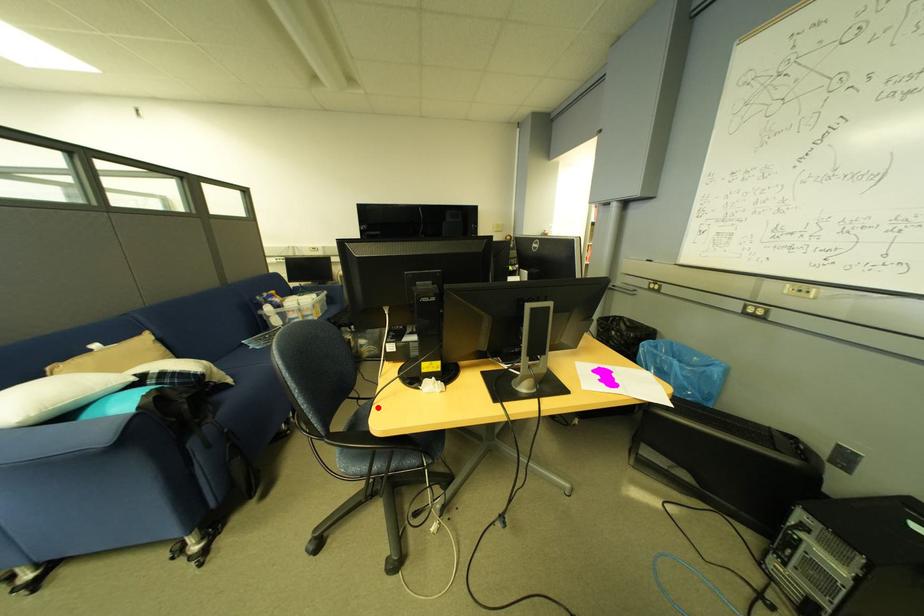
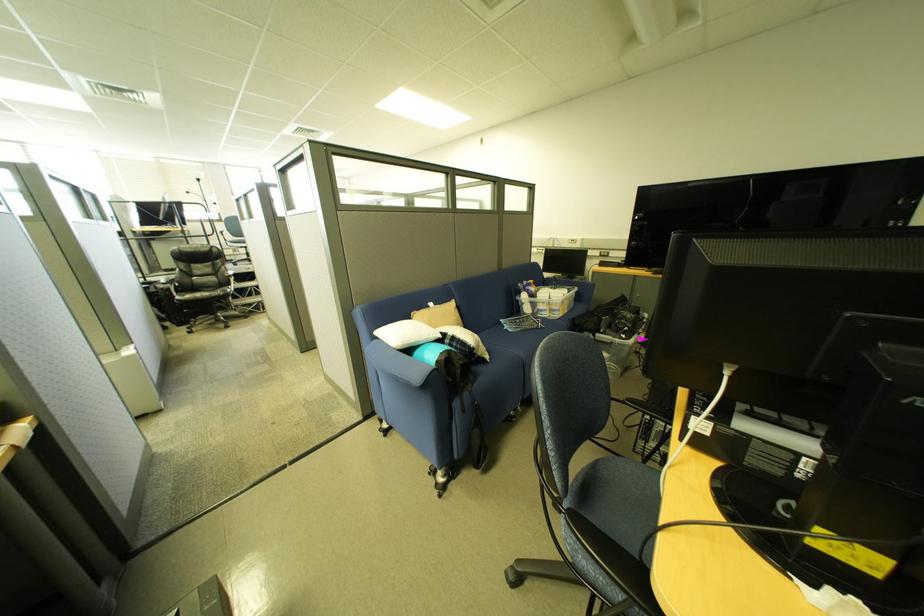
Question: I am providing you with two images of the same scene from different viewpoints. Given a red point in image1, look at the same physical point in image2. Is it:

Choices:
 (A) Closer to the viewpoint
 (B) Farther from the viewpoint

Answer: (A)